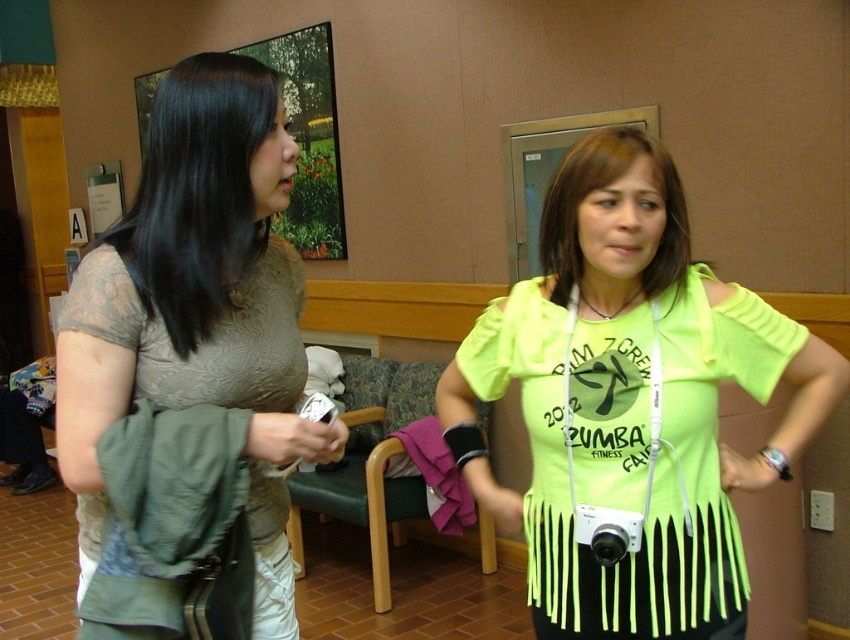
Looking at this image, which is below, neon yellow fabric shirt at center or matte beige blouse at upper left?

Positioned lower is neon yellow fabric shirt at center.

Which is above, neon yellow fabric shirt at center or matte beige blouse at upper left?

matte beige blouse at upper left is above.

You are a GUI agent. You are given a task and a screenshot of the screen. Output one action in this format:
    pyautogui.click(x=<x>, y=<y>)
    Task: Click on the neon yellow fabric shirt at center
    The image size is (850, 640).
    Given the screenshot: What is the action you would take?
    pyautogui.click(x=632, y=401)

Where is `neon yellow fabric shirt at center`? The height and width of the screenshot is (640, 850). neon yellow fabric shirt at center is located at coordinates (632, 401).